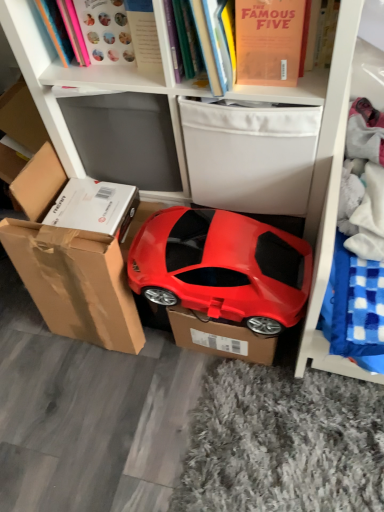
Question: Is hardcover book at upper center, which is the second book in right-to-left order, to the right of matte pink book at upper left, which appears as the third book when viewed from the right, from the viewer's perspective?

Choices:
 (A) yes
 (B) no

Answer: (A)

Question: From the image's perspective, is hardcover book at upper center, the 2th book in the left-to-right sequence, beneath matte pink book at upper left, the 1th book when ordered from left to right?

Choices:
 (A) no
 (B) yes

Answer: (B)

Question: From a real-world perspective, is hardcover book at upper center, which is the second book in right-to-left order, located beneath matte pink book at upper left, the 1th book when ordered from left to right?

Choices:
 (A) yes
 (B) no

Answer: (A)

Question: Is hardcover book at upper center, which is the second book in right-to-left order, completely or partially outside of matte pink book at upper left, which appears as the third book when viewed from the right?

Choices:
 (A) yes
 (B) no

Answer: (A)

Question: Is hardcover book at upper center, which is the second book in right-to-left order, wider than matte pink book at upper left, the 1th book when ordered from left to right?

Choices:
 (A) no
 (B) yes

Answer: (B)

Question: Does point (203, 176) appear closer or farther from the camera than point (39, 5)?

Choices:
 (A) closer
 (B) farther

Answer: (B)

Question: From a real-world perspective, is white fabric storage box at upper center physically located above or below matte pink book at upper left, which appears as the third book when viewed from the right?

Choices:
 (A) below
 (B) above

Answer: (A)

Question: Considering the positions of white fabric storage box at upper center and matte pink book at upper left, which appears as the third book when viewed from the right, in the image, is white fabric storage box at upper center bigger or smaller than matte pink book at upper left, which appears as the third book when viewed from the right,?

Choices:
 (A) big
 (B) small

Answer: (A)

Question: Considering the positions of white fabric storage box at upper center and matte pink book at upper left, which appears as the third book when viewed from the right, in the image, is white fabric storage box at upper center taller or shorter than matte pink book at upper left, which appears as the third book when viewed from the right,?

Choices:
 (A) short
 (B) tall

Answer: (B)

Question: Considering the positions of matte pink book at upper left, the 1th book when ordered from left to right, and matte orange book at upper center, the 1th book positioned from the right, in the image, is matte pink book at upper left, the 1th book when ordered from left to right, wider or thinner than matte orange book at upper center, the 1th book positioned from the right,?

Choices:
 (A) wide
 (B) thin

Answer: (B)

Question: In the image, is matte pink book at upper left, the 1th book when ordered from left to right, positioned in front of or behind matte orange book at upper center, which is the 3th book from left to right?

Choices:
 (A) front
 (B) behind

Answer: (B)

Question: Is matte pink book at upper left, the 1th book when ordered from left to right, to the left or to the right of matte orange book at upper center, which is the 3th book from left to right, in the image?

Choices:
 (A) right
 (B) left

Answer: (B)

Question: Would you say matte pink book at upper left, the 1th book when ordered from left to right, is inside or outside matte orange book at upper center, the 1th book positioned from the right?

Choices:
 (A) outside
 (B) inside

Answer: (A)

Question: Would you say hardcover book at upper center, the 2th book in the left-to-right sequence, is inside or outside matte orange book at upper center, which is the 3th book from left to right?

Choices:
 (A) outside
 (B) inside

Answer: (A)

Question: Considering the positions of hardcover book at upper center, the 2th book in the left-to-right sequence, and matte orange book at upper center, the 1th book positioned from the right, in the image, is hardcover book at upper center, the 2th book in the left-to-right sequence, taller or shorter than matte orange book at upper center, the 1th book positioned from the right,?

Choices:
 (A) tall
 (B) short

Answer: (A)